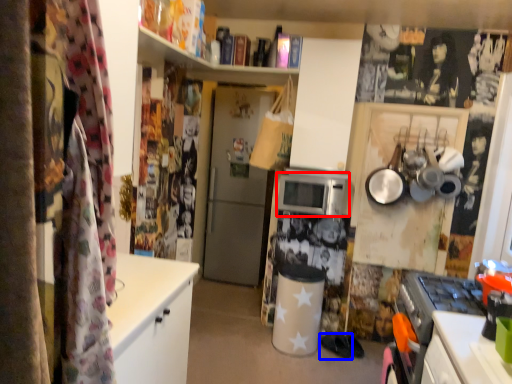
Question: Which object appears closest to the camera in this image, microwave oven (highlighted by a red box) or footwear (highlighted by a blue box)?

Choices:
 (A) microwave oven
 (B) footwear

Answer: (A)